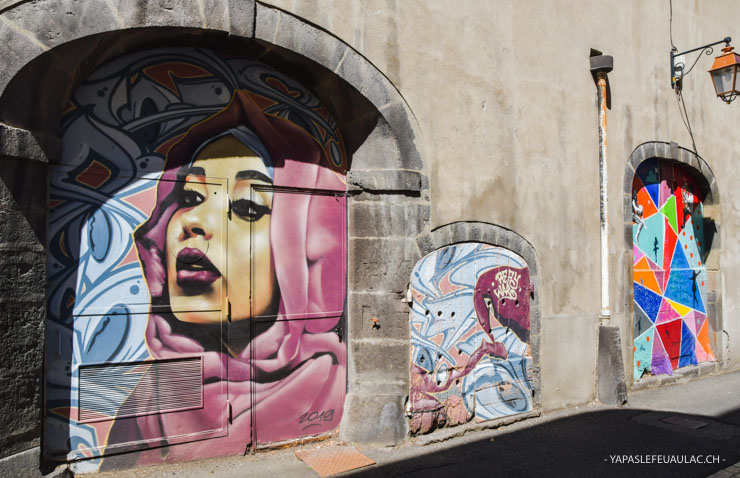
At what (x,y) coordinates should I click in order to perform the action: click on mural. Please return your answer as a coordinate pair (x, y). Looking at the image, I should click on (246, 318), (464, 338), (664, 244).